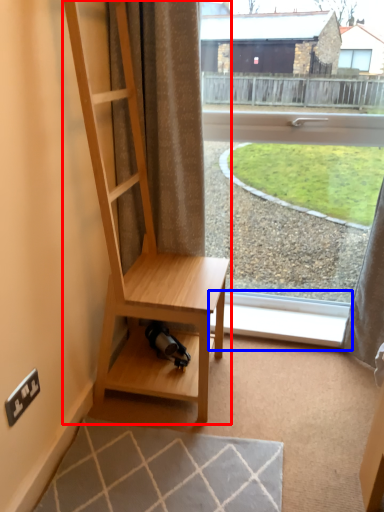
Question: Which of the following is the farthest to the observer, shelf (highlighted by a red box) or window sill (highlighted by a blue box)?

Choices:
 (A) shelf
 (B) window sill

Answer: (B)